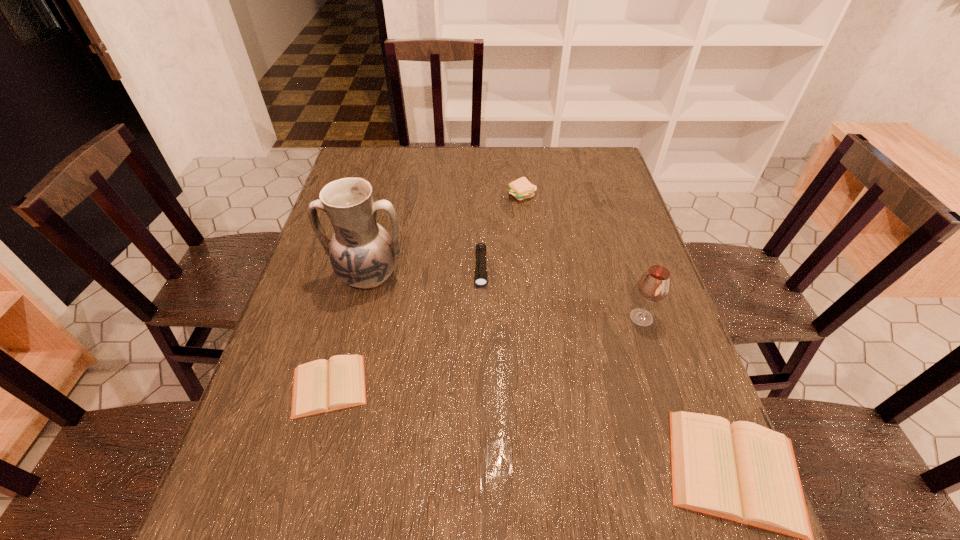
In order to click on the left diary in this screenshot , I will do `click(320, 386)`.

The height and width of the screenshot is (540, 960). I want to click on the shortest object, so click(x=320, y=386).

At what (x,y) coordinates should I click in order to perform the action: click on the third nearest object. Please return your answer as a coordinate pair (x, y). The width and height of the screenshot is (960, 540). Looking at the image, I should click on (654, 285).

This screenshot has height=540, width=960. I want to click on wineglass, so click(x=654, y=285).

Locate an element on the screen. the farthest object is located at coordinates (521, 189).

Identify the location of the third tallest object. The width and height of the screenshot is (960, 540). (521, 189).

Locate an element on the screen. the fourth object from right to left is located at coordinates (480, 275).

I want to click on the tallest object, so click(x=362, y=253).

The image size is (960, 540). I want to click on free space located on the right of the shortest object, so click(403, 386).

The image size is (960, 540). I want to click on free space located on the left of the third nearest object, so click(461, 318).